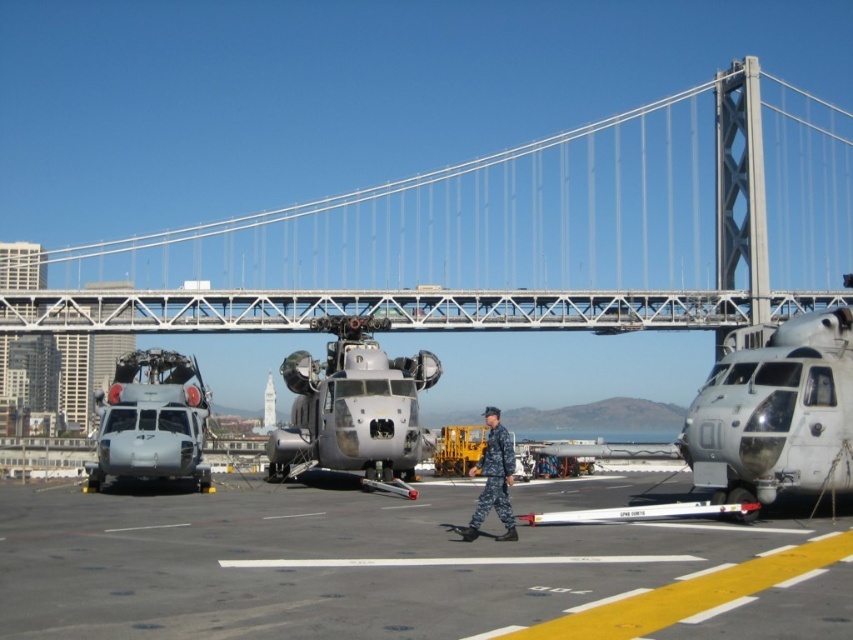
Question: Observing the image, what is the correct spatial positioning of white metallic bridge at center in reference to metallic gray helicopter at center?

Choices:
 (A) right
 (B) left

Answer: (A)

Question: Considering the real-world distances, which object is closest to the white metallic suspension bridge at upper center?

Choices:
 (A) camouflage uniform at center
 (B) metallic gray helicopter at center
 (C) matte gray helicopter at left
 (D) metallic gray helicopter at right

Answer: (A)

Question: Observing the image, what is the correct spatial positioning of metallic gray helicopter at right in reference to matte gray helicopter at left?

Choices:
 (A) below
 (B) above

Answer: (B)

Question: Which of the following is the closest to the observer?

Choices:
 (A) gray asphalt tarmac at center
 (B) metallic gray helicopter at right

Answer: (A)

Question: Estimate the real-world distances between objects in this image. Which object is farther from the white metallic bridge at center?

Choices:
 (A) metallic gray helicopter at center
 (B) metallic gray helicopter at right
 (C) white metallic suspension bridge at upper center
 (D) gray asphalt tarmac at center

Answer: (B)

Question: Is gray asphalt tarmac at center wider than metallic gray helicopter at right?

Choices:
 (A) no
 (B) yes

Answer: (B)